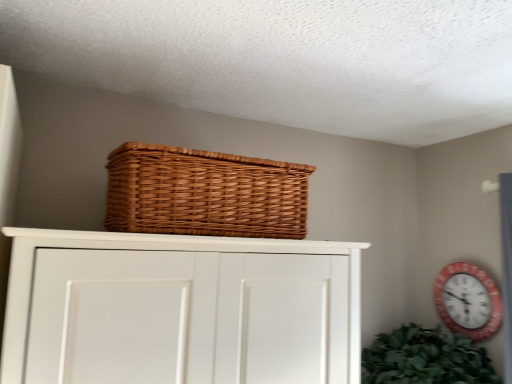
Image resolution: width=512 pixels, height=384 pixels. What do you see at coordinates (468, 301) in the screenshot?
I see `red plastic wall clock at upper right` at bounding box center [468, 301].

This screenshot has width=512, height=384. In order to click on red plastic wall clock at upper right in this screenshot , I will do `click(468, 301)`.

Measure the distance between woven brown basket at upper center and camera.

woven brown basket at upper center is 38.35 inches away from camera.

Locate an element on the screen. The width and height of the screenshot is (512, 384). woven brown basket at upper center is located at coordinates (204, 193).

What do you see at coordinates (204, 193) in the screenshot? The width and height of the screenshot is (512, 384). I see `woven brown basket at upper center` at bounding box center [204, 193].

The width and height of the screenshot is (512, 384). I want to click on red plastic wall clock at upper right, so click(468, 301).

Would you say red plastic wall clock at upper right is to the left or to the right of woven brown basket at upper center in the picture?

Based on their positions, red plastic wall clock at upper right is located to the right of woven brown basket at upper center.

Consider the image. In the image, is red plastic wall clock at upper right positioned in front of or behind woven brown basket at upper center?

In the image, red plastic wall clock at upper right appears behind woven brown basket at upper center.

Does point (466, 267) appear closer or farther from the camera than point (220, 163)?

Point (466, 267).

From the image's perspective, is red plastic wall clock at upper right on top of woven brown basket at upper center?

No, from the image's perspective, red plastic wall clock at upper right is not over woven brown basket at upper center.

From a real-world perspective, which is physically above, red plastic wall clock at upper right or woven brown basket at upper center?

woven brown basket at upper center, from a real-world perspective.

Is red plastic wall clock at upper right wider than woven brown basket at upper center?

In fact, red plastic wall clock at upper right might be narrower than woven brown basket at upper center.

In terms of height, does red plastic wall clock at upper right look taller or shorter compared to woven brown basket at upper center?

Clearly, red plastic wall clock at upper right is taller compared to woven brown basket at upper center.

In terms of size, does red plastic wall clock at upper right appear bigger or smaller than woven brown basket at upper center?

Clearly, red plastic wall clock at upper right is smaller in size than woven brown basket at upper center.

Can woven brown basket at upper center be found inside red plastic wall clock at upper right?

Definitely not — woven brown basket at upper center is not inside red plastic wall clock at upper right.

Is red plastic wall clock at upper right next to woven brown basket at upper center?

No.

Is red plastic wall clock at upper right looking in the opposite direction of woven brown basket at upper center?

No, red plastic wall clock at upper right is not facing the opposite direction of woven brown basket at upper center.

Image resolution: width=512 pixels, height=384 pixels. What are the coordinates of `wall clock below the woven brown basket at upper center (from the image's perspective)` in the screenshot? It's located at (468, 301).

Between woven brown basket at upper center and red plastic wall clock at upper right, which one appears on the right side from the viewer's perspective?

red plastic wall clock at upper right is more to the right.

Considering the positions of objects woven brown basket at upper center and red plastic wall clock at upper right in the image provided, who is in front, woven brown basket at upper center or red plastic wall clock at upper right?

woven brown basket at upper center is closer to the camera.

Which is behind, point (127, 229) or point (458, 263)?

Point (458, 263)

From the image's perspective, is woven brown basket at upper center located above red plastic wall clock at upper right?

Correct, woven brown basket at upper center appears higher than red plastic wall clock at upper right in the image.

From a real-world perspective, between woven brown basket at upper center and red plastic wall clock at upper right, who is vertically higher?

woven brown basket at upper center is physically above.

Which object is wider, woven brown basket at upper center or red plastic wall clock at upper right?

With larger width is woven brown basket at upper center.

Which of these two, woven brown basket at upper center or red plastic wall clock at upper right, stands shorter?

With less height is woven brown basket at upper center.

Between woven brown basket at upper center and red plastic wall clock at upper right, which one has larger size?

With larger size is woven brown basket at upper center.

Would you say woven brown basket at upper center is inside or outside red plastic wall clock at upper right?

woven brown basket at upper center is not inside red plastic wall clock at upper right, it's outside.

Is woven brown basket at upper center not near red plastic wall clock at upper right?

woven brown basket at upper center is positioned a significant distance from red plastic wall clock at upper right.

Is woven brown basket at upper center looking in the opposite direction of red plastic wall clock at upper right?

No, woven brown basket at upper center is not facing away from red plastic wall clock at upper right.

How many degrees apart are the facing directions of woven brown basket at upper center and red plastic wall clock at upper right?

The angular difference between woven brown basket at upper center and red plastic wall clock at upper right is 89.1 degrees.

Image resolution: width=512 pixels, height=384 pixels. Identify the location of basket above the red plastic wall clock at upper right (from the image's perspective). (204, 193).

Locate an element on the screen. Image resolution: width=512 pixels, height=384 pixels. wall clock lying below the woven brown basket at upper center (from the image's perspective) is located at coordinates (468, 301).

Identify the location of basket in front of the red plastic wall clock at upper right. (204, 193).